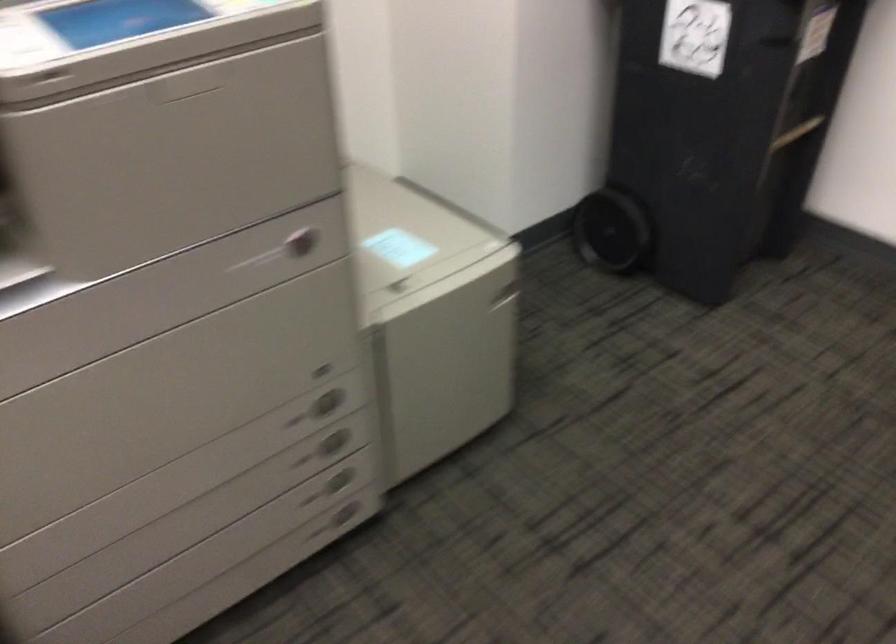
Find the location of a particular element. This screenshot has width=896, height=644. side cabinet handle is located at coordinates (299, 242).